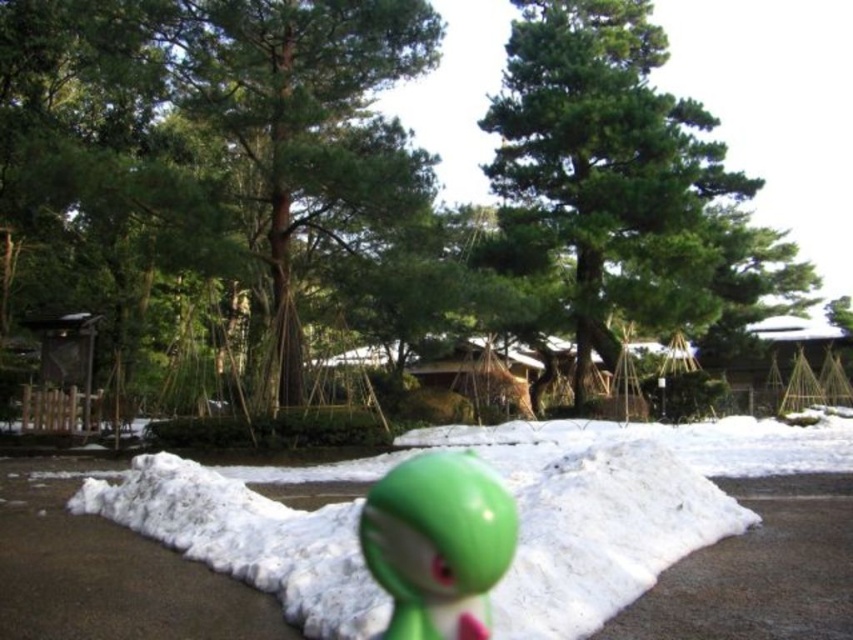
You are a delivery robot with a 15 feet long package. You need to place the package between the white fluffy snow at center and the green matte toy at center. Is there enough space to fit the package without overlapping either object?

The distance between the white fluffy snow at center and the green matte toy at center is 18.20 feet. Since the package is 15 feet long, there is enough space to fit it between them without overlapping either object.